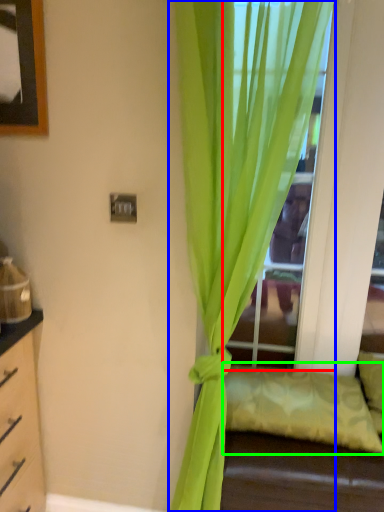
Question: Estimate the real-world distances between objects in this image. Which object is closer to glass door (highlighted by a red box), curtain (highlighted by a blue box) or pillow (highlighted by a green box)?

Choices:
 (A) curtain
 (B) pillow

Answer: (A)